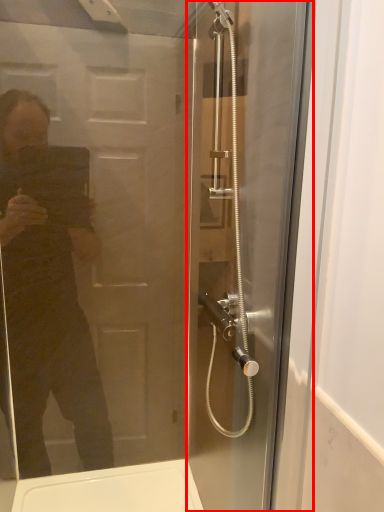
Question: In this image, where is screen door (annotated by the red box) located relative to screen door?

Choices:
 (A) left
 (B) right

Answer: (B)